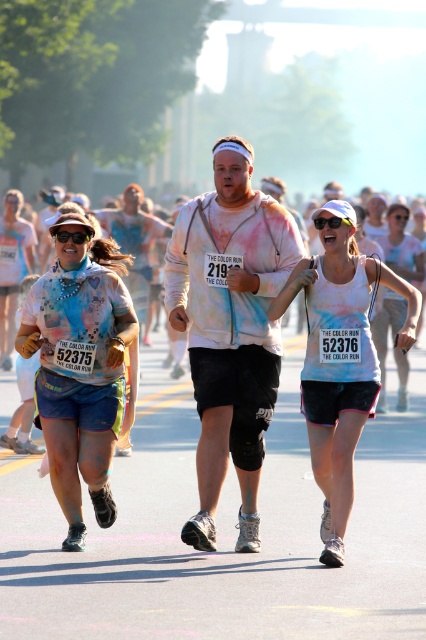
Question: Does matte blue shorts at left appear over transparent plastic goggles at center?

Choices:
 (A) no
 (B) yes

Answer: (A)

Question: Which point is farther from the camera taking this photo?

Choices:
 (A) (397, 243)
 (B) (89, 236)
 (C) (356, 424)
 (D) (89, 374)

Answer: (A)

Question: Can you confirm if matte blue shorts at left is positioned to the left of white tie-dye tank top at center?

Choices:
 (A) no
 (B) yes

Answer: (B)

Question: Is matte blue shorts at left wider than black plastic goggles at upper center?

Choices:
 (A) no
 (B) yes

Answer: (B)

Question: Which of these objects is positioned closest to the white tie-dye tank top at center?

Choices:
 (A) black plastic goggles at upper center
 (B) transparent plastic goggles at center
 (C) white matte tank top at center

Answer: (B)

Question: Which object appears closest to the camera in this image?

Choices:
 (A) black plastic goggles at upper center
 (B) white matte tank top at center
 (C) transparent plastic goggles at center
 (D) matte blue shorts at left

Answer: (D)